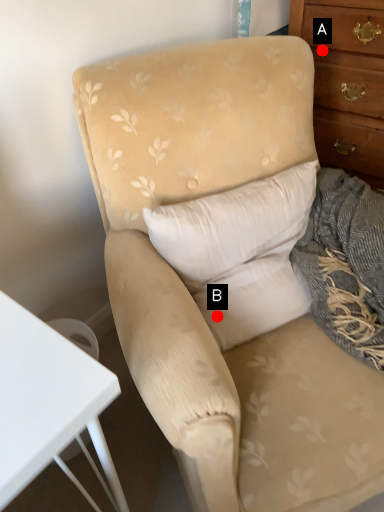
Question: Two points are circled on the image, labeled by A and B beside each circle. Which point is further to the camera?

Choices:
 (A) A is further
 (B) B is further

Answer: (A)